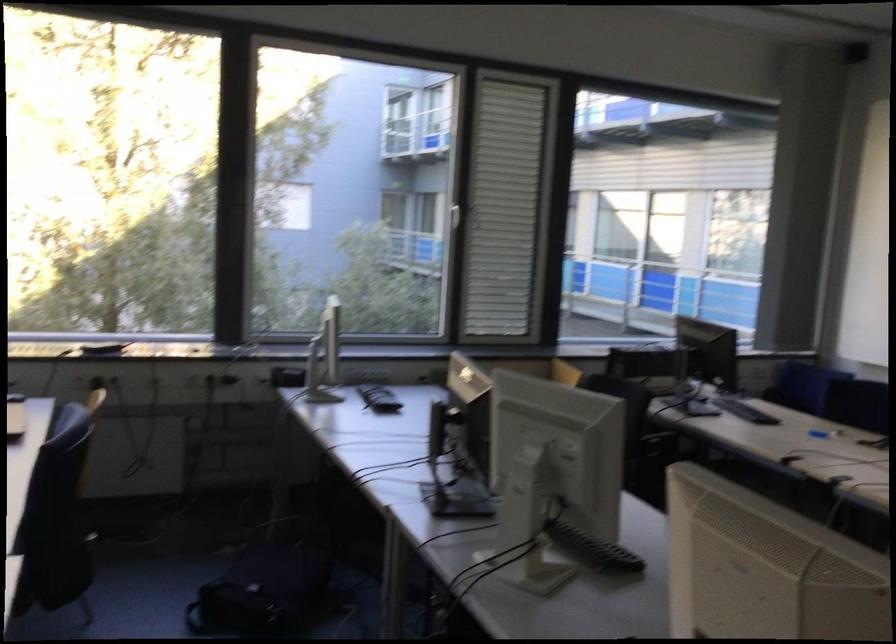
Where would you lift the black office phone? Please return your answer as a coordinate pair (x, y).

(104, 348)